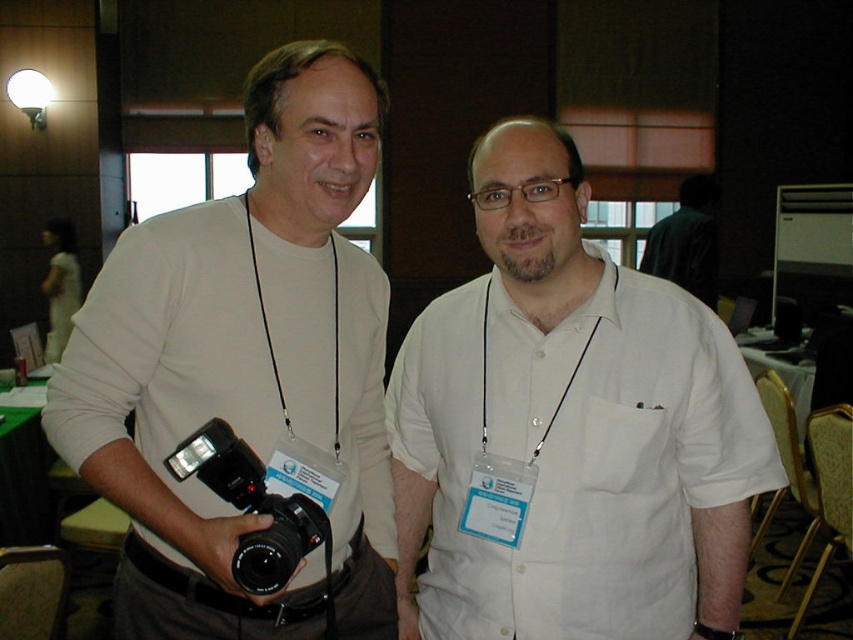
From the picture: Does white cotton shirt at center have a greater height compared to black plastic camera at left?

Indeed, white cotton shirt at center has a greater height compared to black plastic camera at left.

From the picture: Who is lower down, white cotton shirt at center or black plastic camera at left?

black plastic camera at left

Does point (492, 298) lie in front of point (258, 474)?

No, it is behind (258, 474).

You are a GUI agent. You are given a task and a screenshot of the screen. Output one action in this format:
    pyautogui.click(x=<x>, y=<y>)
    Task: Click on the white cotton shirt at center
    
    Given the screenshot: What is the action you would take?
    pyautogui.click(x=576, y=456)

Who is shorter, matte white camera at left or black plastic camera at left?

Standing shorter between the two is black plastic camera at left.

This screenshot has height=640, width=853. What are the coordinates of `matte white camera at left` in the screenshot? It's located at (244, 365).

Is point (187, 371) behind point (236, 448)?

Yes.

Locate an element on the screen. The height and width of the screenshot is (640, 853). matte white camera at left is located at coordinates (244, 365).

Does matte white camera at left have a greater height compared to white cotton shirt at center?

Indeed, matte white camera at left has a greater height compared to white cotton shirt at center.

Is matte white camera at left positioned behind white cotton shirt at center?

No, matte white camera at left is in front of white cotton shirt at center.

Does point (334, 248) come farther from viewer compared to point (677, 540)?

Yes, it is.

The width and height of the screenshot is (853, 640). I want to click on matte white camera at left, so click(244, 365).